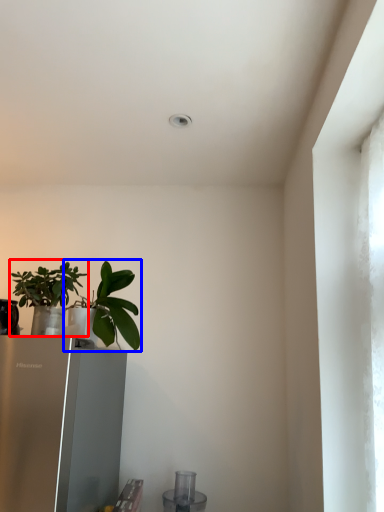
Question: Which object appears closest to the camera in this image, houseplant (highlighted by a red box) or houseplant (highlighted by a blue box)?

Choices:
 (A) houseplant
 (B) houseplant

Answer: (A)